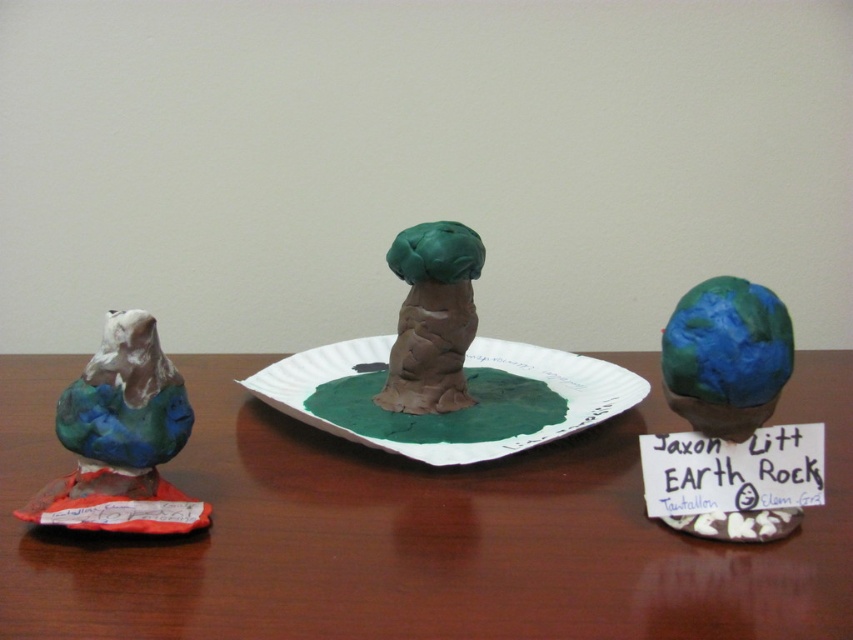
Question: Which point appears closest to the camera in this image?

Choices:
 (A) [x=113, y=323]
 (B) [x=389, y=246]
 (C) [x=552, y=429]

Answer: (A)

Question: Which of the following is the farthest from the observer?

Choices:
 (A) wooden table at center
 (B) green paper plate at center
 (C) matte clay bird at left
 (D) matte clay tree at center

Answer: (D)

Question: From the image, what is the correct spatial relationship of green paper plate at center in relation to matte clay bird at left?

Choices:
 (A) above
 (B) below

Answer: (A)

Question: Is wooden table at center closer to the viewer compared to green paper plate at center?

Choices:
 (A) yes
 (B) no

Answer: (A)

Question: Considering the relative positions of wooden table at center and matte clay tree at center in the image provided, where is wooden table at center located with respect to matte clay tree at center?

Choices:
 (A) left
 (B) right

Answer: (A)

Question: Which object is closer to the camera taking this photo?

Choices:
 (A) matte clay bird at left
 (B) wooden table at center
 (C) matte clay tree at center
 (D) green paper plate at center

Answer: (B)